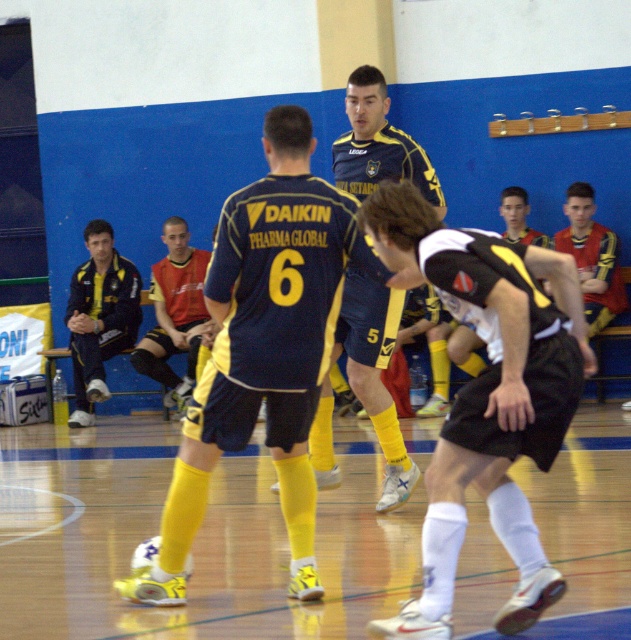
Can you confirm if white matte jersey at center is positioned below red jersey at center?

Indeed, white matte jersey at center is positioned under red jersey at center.

You are a GUI agent. You are given a task and a screenshot of the screen. Output one action in this format:
    pyautogui.click(x=<x>, y=<y>)
    Task: Click on the white matte jersey at center
    This screenshot has height=640, width=631.
    Given the screenshot: What is the action you would take?
    pyautogui.click(x=487, y=396)

Measure the distance between point (510, 435) and camera.

Point (510, 435) and camera are 20.92 feet apart from each other.

At what (x,y) coordinates should I click in order to perform the action: click on white matte jersey at center. Please return your answer as a coordinate pair (x, y). The height and width of the screenshot is (640, 631). Looking at the image, I should click on (487, 396).

Who is lower down, matte blue shorts at center or dark blue track suit at left?

matte blue shorts at center is below.

Is matte blue shorts at center below dark blue track suit at left?

Indeed, matte blue shorts at center is positioned under dark blue track suit at left.

Between point (442, 204) and point (86, 291), which one is positioned in front?

Positioned in front is point (442, 204).

This screenshot has width=631, height=640. In order to click on matte blue shorts at center in this screenshot , I will do `click(374, 372)`.

Measure the distance from white matte jersey at center to dark blue track suit at left.

They are 37.57 feet apart.

Which is in front, point (521, 301) or point (112, 284)?

Point (521, 301)

The height and width of the screenshot is (640, 631). In order to click on white matte jersey at center in this screenshot , I will do click(487, 396).

This screenshot has height=640, width=631. Identify the location of white matte jersey at center. (487, 396).